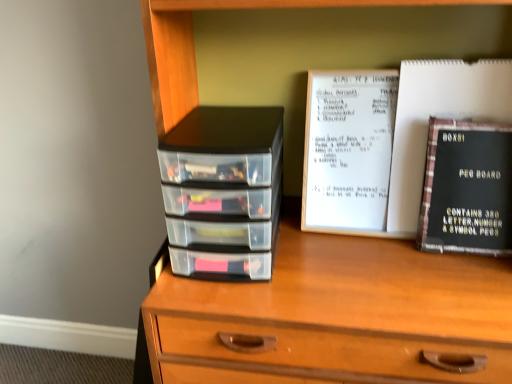
Question: Is black matte peg board at right taller or shorter than wooden chest of drawers at center?

Choices:
 (A) short
 (B) tall

Answer: (A)

Question: From the image's perspective, is black matte peg board at right located above or below wooden chest of drawers at center?

Choices:
 (A) above
 (B) below

Answer: (A)

Question: Which object is positioned farthest from the wooden chest of drawers at center?

Choices:
 (A) black matte peg board at right
 (B) black matte peg board at right
 (C) transparent plastic drawers at left

Answer: (B)

Question: Which is farther from the black matte peg board at right?

Choices:
 (A) wooden chest of drawers at center
 (B) black matte peg board at right
 (C) transparent plastic drawers at left

Answer: (C)